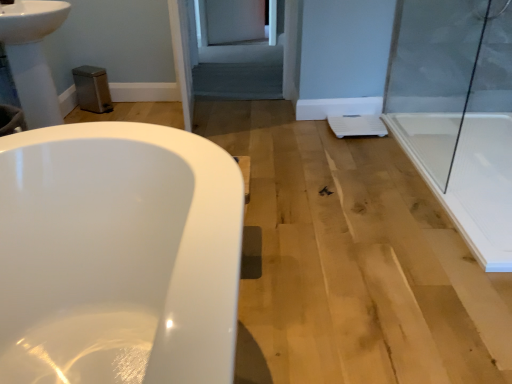
Describe the element at coordinates (236, 53) in the screenshot. The image size is (512, 384). I see `gray fabric screen door at center` at that location.

Locate an element on the screen. This screenshot has height=384, width=512. white glossy sink at upper left is located at coordinates (33, 59).

Measure the distance between point (461, 91) and camera.

Point (461, 91) is 9.36 feet away from camera.

The height and width of the screenshot is (384, 512). Find the location of `silver metallic faucet at upper left`. silver metallic faucet at upper left is located at coordinates (12, 7).

The width and height of the screenshot is (512, 384). Find the location of `gray fabric screen door at center`. gray fabric screen door at center is located at coordinates (236, 53).

Is white glossy sink at upper left looking in the opposite direction of transparent glass shower door at right?

No, white glossy sink at upper left is not facing away from transparent glass shower door at right.

From a real-world perspective, which is physically above, white glossy sink at upper left or transparent glass shower door at right?

transparent glass shower door at right, from a real-world perspective.

Would you say white glossy sink at upper left is a long distance from transparent glass shower door at right?

Indeed, white glossy sink at upper left is not near transparent glass shower door at right.

How many degrees apart are the facing directions of white glossy sink at upper left and transparent glass shower door at right?

The facing directions of white glossy sink at upper left and transparent glass shower door at right are 1.51 degrees apart.

Looking at this image, from the image's perspective, which one is positioned lower, gray fabric screen door at center or transparent glass shower door at right?

transparent glass shower door at right appears lower in the image.

Considering the positions of objects gray fabric screen door at center and transparent glass shower door at right in the image provided, who is behind, gray fabric screen door at center or transparent glass shower door at right?

gray fabric screen door at center is more distant.

Considering the points (237, 44) and (510, 56), which point is in front, point (237, 44) or point (510, 56)?

The point (510, 56) is closer to the camera.

How much distance is there between gray fabric screen door at center and transparent glass shower door at right?

gray fabric screen door at center and transparent glass shower door at right are 1.54 meters apart from each other.

I want to click on faucet above the white glossy sink at upper left (from a real-world perspective), so click(12, 7).

Which is closer to the camera, (10, 4) or (48, 19)?

The point (48, 19) is closer.

Is silver metallic faucet at upper left positioned beyond the bounds of white glossy sink at upper left?

Yes, silver metallic faucet at upper left is outside of white glossy sink at upper left.

Can you see silver metallic faucet at upper left touching white glossy sink at upper left?

No.

Considering the sizes of objects white glossy sink at upper left and silver metallic faucet at upper left in the image provided, who is shorter, white glossy sink at upper left or silver metallic faucet at upper left?

silver metallic faucet at upper left is shorter.

Which point is more forward, (22, 38) or (1, 9)?

Positioned in front is point (22, 38).

Is white glossy sink at upper left surrounding silver metallic faucet at upper left?

No, silver metallic faucet at upper left is not inside white glossy sink at upper left.

Find the location of `sink below the gray fabric screen door at center (from the image's perspective)`. sink below the gray fabric screen door at center (from the image's perspective) is located at coordinates (33, 59).

Could you tell me if gray fabric screen door at center is turned towards white glossy sink at upper left?

No, gray fabric screen door at center does not turn towards white glossy sink at upper left.

Between gray fabric screen door at center and white glossy sink at upper left, which one appears on the left side from the viewer's perspective?

white glossy sink at upper left.

How many degrees apart are the facing directions of transparent glass shower door at right and gray fabric screen door at center?

89.1 degrees.

From a real-world perspective, who is located lower, transparent glass shower door at right or gray fabric screen door at center?

gray fabric screen door at center, from a real-world perspective.

Which point is more distant from viewer, [411,140] or [268,57]?

The point [268,57] is behind.

Based on their sizes in the image, would you say transparent glass shower door at right is bigger or smaller than gray fabric screen door at center?

transparent glass shower door at right is smaller than gray fabric screen door at center.

Are transparent glass shower door at right and white glossy sink at upper left beside each other?

transparent glass shower door at right and white glossy sink at upper left are clearly separated.

From a real-world perspective, is transparent glass shower door at right beneath white glossy sink at upper left?

No.

Is transparent glass shower door at right spatially inside white glossy sink at upper left, or outside of it?

transparent glass shower door at right cannot be found inside white glossy sink at upper left.

I want to click on sink that is below the transparent glass shower door at right (from the image's perspective), so click(x=33, y=59).

Image resolution: width=512 pixels, height=384 pixels. In order to click on screen door that appears below the transparent glass shower door at right (from a real-world perspective) in this screenshot , I will do `click(236, 53)`.

Looking at the image, which one is located further to silver metallic faucet at upper left, transparent glass shower door at right or white glossy sink at upper left?

The object further to silver metallic faucet at upper left is transparent glass shower door at right.

When comparing their distances from gray fabric screen door at center, does transparent glass shower door at right or white glossy sink at upper left seem further?

Based on the image, white glossy sink at upper left appears to be further to gray fabric screen door at center.

Based on their spatial positions, is white glossy sink at upper left or gray fabric screen door at center further from transparent glass shower door at right?

white glossy sink at upper left lies further to transparent glass shower door at right than the other object.

Which object lies further to the anchor point white glossy sink at upper left, silver metallic faucet at upper left or gray fabric screen door at center?

Based on the image, gray fabric screen door at center appears to be further to white glossy sink at upper left.

Looking at the image, which one is located further to transparent glass shower door at right, gray fabric screen door at center or white glossy sink at upper left?

The object further to transparent glass shower door at right is white glossy sink at upper left.

Looking at the image, which one is located further to white glossy sink at upper left, silver metallic faucet at upper left or transparent glass shower door at right?

transparent glass shower door at right lies further to white glossy sink at upper left than the other object.

Based on the photo, estimate the real-world distances between objects in this image. Which object is further from gray fabric screen door at center, silver metallic faucet at upper left or white glossy sink at upper left?

silver metallic faucet at upper left is further to gray fabric screen door at center.

Estimate the real-world distances between objects in this image. Which object is closer to transparent glass shower door at right, silver metallic faucet at upper left or white glossy sink at upper left?

white glossy sink at upper left.

Find the location of `screen door between white glossy sink at upper left and transparent glass shower door at right`. screen door between white glossy sink at upper left and transparent glass shower door at right is located at coordinates (236, 53).

This screenshot has height=384, width=512. In order to click on sink between silver metallic faucet at upper left and transparent glass shower door at right in the horizontal direction in this screenshot , I will do `click(33, 59)`.

This screenshot has height=384, width=512. Identify the location of faucet positioned between white glossy sink at upper left and gray fabric screen door at center from near to far. (12, 7).

Where is `screen door between silver metallic faucet at upper left and transparent glass shower door at right in the horizontal direction`? screen door between silver metallic faucet at upper left and transparent glass shower door at right in the horizontal direction is located at coordinates point(236,53).